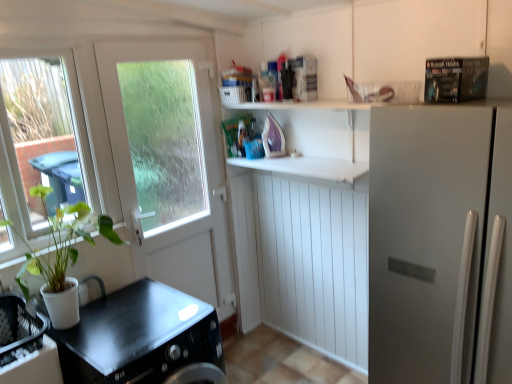
Question: Can you confirm if white matte counter top at center, acting as the first counter top starting from the top, is shorter than white matte refrigerator at right?

Choices:
 (A) no
 (B) yes

Answer: (B)

Question: Is the position of white matte counter top at center, the second counter top positioned from the left, less distant than that of white matte refrigerator at right?

Choices:
 (A) no
 (B) yes

Answer: (A)

Question: Is white matte refrigerator at right a part of white matte counter top at center, the first counter top in the right-to-left sequence?

Choices:
 (A) yes
 (B) no

Answer: (B)

Question: Is white matte counter top at center, the first counter top in the right-to-left sequence, to the right of white matte refrigerator at right from the viewer's perspective?

Choices:
 (A) no
 (B) yes

Answer: (A)

Question: From the image's perspective, does white matte counter top at center, acting as the first counter top starting from the top, appear higher than white matte refrigerator at right?

Choices:
 (A) no
 (B) yes

Answer: (B)

Question: Is white matte counter top at center, the first counter top in the right-to-left sequence, positioned before metallic silver magazine at upper right?

Choices:
 (A) yes
 (B) no

Answer: (B)

Question: Is white matte counter top at center, the second counter top positioned from the left, thinner than metallic silver magazine at upper right?

Choices:
 (A) yes
 (B) no

Answer: (A)

Question: From a real-world perspective, is white matte counter top at center, the second counter top positioned from the left, located higher than metallic silver magazine at upper right?

Choices:
 (A) no
 (B) yes

Answer: (A)

Question: Is white matte counter top at center, acting as the first counter top starting from the top, completely or partially outside of metallic silver magazine at upper right?

Choices:
 (A) no
 (B) yes

Answer: (B)

Question: Considering the relative positions of white matte counter top at center, acting as the first counter top starting from the top, and metallic silver magazine at upper right in the image provided, is white matte counter top at center, acting as the first counter top starting from the top, to the left of metallic silver magazine at upper right from the viewer's perspective?

Choices:
 (A) no
 (B) yes

Answer: (B)

Question: Does white matte counter top at center, acting as the first counter top starting from the top, turn towards metallic silver magazine at upper right?

Choices:
 (A) no
 (B) yes

Answer: (A)

Question: Does white matte door at upper left have a greater width compared to white matte counter top at center, the second counter top positioned from the left?

Choices:
 (A) no
 (B) yes

Answer: (A)